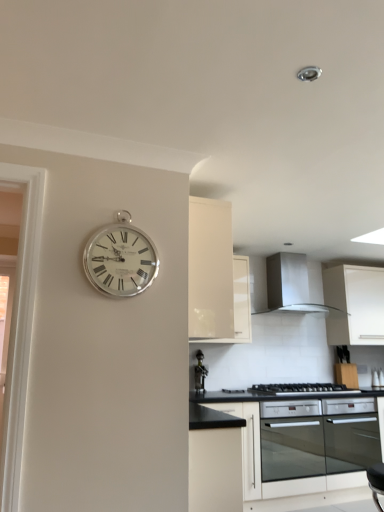
Where is `black matte gas stove at lower center`? The height and width of the screenshot is (512, 384). black matte gas stove at lower center is located at coordinates (301, 388).

The width and height of the screenshot is (384, 512). Describe the element at coordinates (301, 388) in the screenshot. I see `black matte gas stove at lower center` at that location.

This screenshot has width=384, height=512. Describe the element at coordinates (318, 444) in the screenshot. I see `black glass oven at lower center` at that location.

You are a GUI agent. You are given a task and a screenshot of the screen. Output one action in this format:
    pyautogui.click(x=<x>, y=<y>)
    Task: Click on the silver metallic clock at upper left
    
    Given the screenshot: What is the action you would take?
    pyautogui.click(x=120, y=259)

Describe the element at coordinates (200, 372) in the screenshot. The image size is (384, 512). I see `metallic wine rack at center` at that location.

Identify the location of black matte cabinet at center, the 2th cabinetry positioned from the right. The width and height of the screenshot is (384, 512). (214, 460).

Describe the element at coordinates (214, 460) in the screenshot. I see `black matte cabinet at center, arranged as the 2th cabinetry when viewed from the left` at that location.

You are a GUI agent. You are given a task and a screenshot of the screen. Output one action in this format:
    pyautogui.click(x=<x>, y=<y>)
    Task: Click on the white matte cabinet at right, the 1th cabinetry when ordered from right to left
    This screenshot has height=512, width=384.
    Given the screenshot: What is the action you would take?
    pyautogui.click(x=355, y=304)

Image resolution: width=384 pixels, height=512 pixels. Describe the element at coordinates (355, 304) in the screenshot. I see `white matte cabinet at right, the third cabinetry in the left-to-right sequence` at that location.

In order to face white glossy cabinet at upper center, the second cabinetry viewed from the back, should I rotate leftwards or rightwards?

It's best to rotate left around 0.164 degrees.

The image size is (384, 512). Identify the location of satin silver exhaust hood at upper center. (290, 285).

Find the location of a particular element. This screenshot has width=384, height=512. gas stove behind the black glass oven at lower center is located at coordinates (301, 388).

Is black matte gas stove at lower center facing towards black glass oven at lower center?

No, black matte gas stove at lower center does not turn towards black glass oven at lower center.

Can we say black matte gas stove at lower center lies outside black glass oven at lower center?

That's correct, black matte gas stove at lower center is outside of black glass oven at lower center.

Is black matte gas stove at lower center with black glass oven at lower center?

No.

Are satin silver exhaust hood at upper center and black glass oven at lower center making contact?

No, satin silver exhaust hood at upper center is not beside black glass oven at lower center.

Can you tell me how much satin silver exhaust hood at upper center and black glass oven at lower center differ in facing direction?

There is a 0.303-degree angle between the facing directions of satin silver exhaust hood at upper center and black glass oven at lower center.

From the picture: Is satin silver exhaust hood at upper center located outside black glass oven at lower center?

Yes.

Considering the positions of objects satin silver exhaust hood at upper center and black glass oven at lower center in the image provided, who is in front, satin silver exhaust hood at upper center or black glass oven at lower center?

black glass oven at lower center is more forward.

Does point (112, 237) appear closer or farther from the camera than point (309, 389)?

Clearly, point (112, 237) is closer to the camera than point (309, 389).

From the image's perspective, does silver metallic clock at upper left appear lower than black matte gas stove at lower center?

No, from the image's perspective, silver metallic clock at upper left is not below black matte gas stove at lower center.

Is silver metallic clock at upper left looking in the opposite direction of black matte gas stove at lower center?

No, black matte gas stove at lower center is not at the back of silver metallic clock at upper left.

Consider the image. Can we say metallic wine rack at center lies outside satin silver exhaust hood at upper center?

metallic wine rack at center lies outside satin silver exhaust hood at upper center's area.

Is the surface of metallic wine rack at center in direct contact with satin silver exhaust hood at upper center?

No, metallic wine rack at center is not in contact with satin silver exhaust hood at upper center.

Is point (195, 373) closer or farther from the camera than point (295, 306)?

Point (195, 373).

Locate an element on the screen. exhaust hood that is above the metallic wine rack at center (from a real-world perspective) is located at coordinates (290, 285).

Is satin silver exhaust hood at upper center with silver metallic clock at upper left?

No, satin silver exhaust hood at upper center is not beside silver metallic clock at upper left.

Is satin silver exhaust hood at upper center oriented towards silver metallic clock at upper left?

No.

Where is `wall clock that is on the left side of satin silver exhaust hood at upper center`? The height and width of the screenshot is (512, 384). wall clock that is on the left side of satin silver exhaust hood at upper center is located at coordinates (120, 259).

From the image's perspective, is satin silver exhaust hood at upper center located above or below silver metallic clock at upper left?

From the image's perspective, satin silver exhaust hood at upper center appears below silver metallic clock at upper left.

Is black matte cabinet at center, which is the third cabinetry in back-to-front order, outside of black matte gas stove at lower center?

black matte cabinet at center, which is the third cabinetry in back-to-front order, lies outside black matte gas stove at lower center's area.

Are black matte cabinet at center, the 2th cabinetry positioned from the right, and black matte gas stove at lower center beside each other?

No, black matte cabinet at center, the 2th cabinetry positioned from the right, is not next to black matte gas stove at lower center.

Is point (198, 486) more distant than point (266, 393)?

That is False.

Between metallic wine rack at center and white matte cabinet at right, which is the third cabinetry from front to back, which one appears on the left side from the viewer's perspective?

metallic wine rack at center.

Based on the photo, is metallic wine rack at center facing away from white matte cabinet at right, which is the third cabinetry from front to back?

No, metallic wine rack at center is not facing away from white matte cabinet at right, which is the third cabinetry from front to back.

Who is shorter, metallic wine rack at center or white matte cabinet at right, the 1th cabinetry when ordered from back to front?

With less height is metallic wine rack at center.

Find the location of a particular element. Image resolution: width=384 pixels, height=512 pixels. gas stove behind the black glass oven at lower center is located at coordinates (301, 388).

You are a GUI agent. You are given a task and a screenshot of the screen. Output one action in this format:
    pyautogui.click(x=<x>, y=<y>)
    Task: Click on the exhaust hood above the black glass oven at lower center (from a real-world perspective)
    This screenshot has width=384, height=512.
    Given the screenshot: What is the action you would take?
    pyautogui.click(x=290, y=285)

Which object lies nearer to the anchor point black glass oven at lower center, white matte cabinet at right, which is the third cabinetry from front to back, or silver metallic clock at upper left?

white matte cabinet at right, which is the third cabinetry from front to back.

From the image, which object appears to be nearer to black matte gas stove at lower center, metallic wine rack at center or black matte cabinet at center, arranged as the 2th cabinetry when viewed from the left?

Among the two, metallic wine rack at center is located nearer to black matte gas stove at lower center.

Which object lies nearer to the anchor point metallic wine rack at center, black matte cabinet at center, arranged as the 2th cabinetry when viewed from the left, or satin silver exhaust hood at upper center?

satin silver exhaust hood at upper center is closer to metallic wine rack at center.

Looking at the image, which one is located further to black glass oven at lower center, black matte cabinet at center, arranged as the 2th cabinetry when viewed from the left, or silver metallic clock at upper left?

silver metallic clock at upper left is further to black glass oven at lower center.

Based on the photo, from the image, which object appears to be farther from silver metallic clock at upper left, white matte cabinet at right, which is the third cabinetry from front to back, or metallic wine rack at center?

The object further to silver metallic clock at upper left is white matte cabinet at right, which is the third cabinetry from front to back.

Considering their positions, is white matte cabinet at right, the 1th cabinetry when ordered from right to left, positioned further to black matte gas stove at lower center than satin silver exhaust hood at upper center?

satin silver exhaust hood at upper center.

From the image, which object appears to be farther from black glass oven at lower center, black matte gas stove at lower center or black matte cabinet at center, the 2th cabinetry positioned from the right?

black matte cabinet at center, the 2th cabinetry positioned from the right, lies further to black glass oven at lower center than the other object.

When comparing their distances from white glossy cabinet at upper center, placed as the 3th cabinetry when sorted from right to left, does metallic wine rack at center or black matte cabinet at center, arranged as the 2th cabinetry when viewed from the left, seem closer?

black matte cabinet at center, arranged as the 2th cabinetry when viewed from the left, lies closer to white glossy cabinet at upper center, placed as the 3th cabinetry when sorted from right to left, than the other object.

Identify the location of appliance between black matte cabinet at center, arranged as the 2th cabinetry when viewed from the left, and satin silver exhaust hood at upper center, along the z-axis. Image resolution: width=384 pixels, height=512 pixels. (200, 372).

Where is `oven between silver metallic clock at upper left and black matte gas stove at lower center in the front-back direction`? This screenshot has width=384, height=512. oven between silver metallic clock at upper left and black matte gas stove at lower center in the front-back direction is located at coordinates (318, 444).

Locate an element on the screen. oven positioned between silver metallic clock at upper left and metallic wine rack at center from near to far is located at coordinates (318, 444).

This screenshot has height=512, width=384. I want to click on gas stove located between white glossy cabinet at upper center, placed as the 3th cabinetry when sorted from right to left, and satin silver exhaust hood at upper center in the depth direction, so click(x=301, y=388).